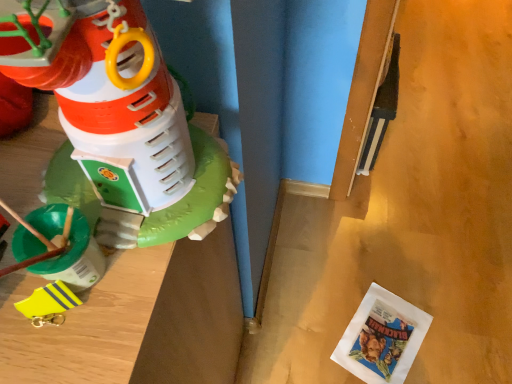
Where is `empty space that is to the right of yellow rubber boot at left, which appears as the 1th toy when viewed from the back`? The image size is (512, 384). empty space that is to the right of yellow rubber boot at left, which appears as the 1th toy when viewed from the back is located at coordinates (131, 304).